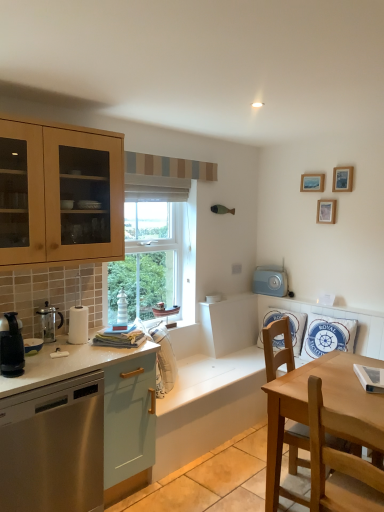
This screenshot has width=384, height=512. What are the coordinates of `free region on the left part of wooden chair at lower right, positioned as the 2th chair in front-to-back order` in the screenshot? It's located at (234, 477).